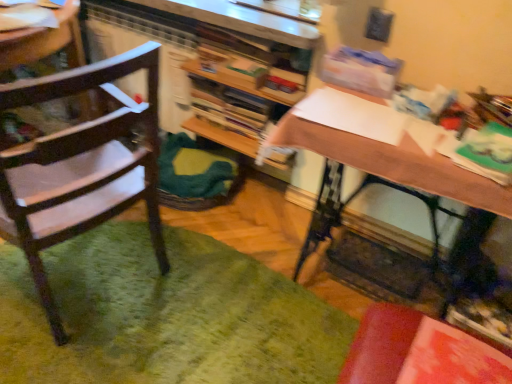
Locate an element on the screen. This screenshot has width=512, height=384. spots to the right of wooden chair at left is located at coordinates (204, 306).